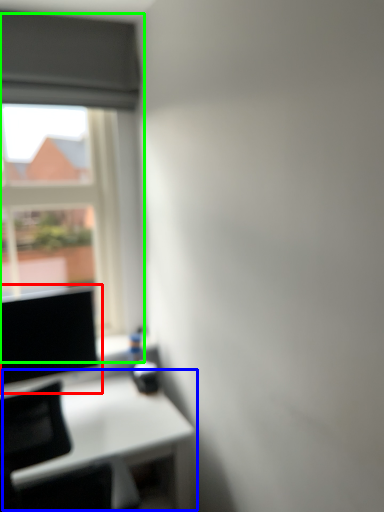
Question: Which is nearer to the computer screen (highlighted by a red box)? table (highlighted by a blue box) or window (highlighted by a green box).

Choices:
 (A) table
 (B) window

Answer: (A)